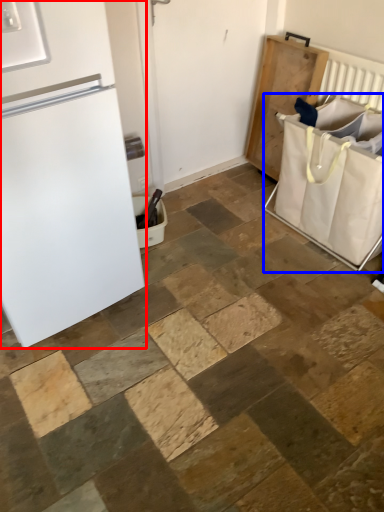
Question: Which object appears farthest to the camera in this image, refrigerator (highlighted by a red box) or laundry basket (highlighted by a blue box)?

Choices:
 (A) refrigerator
 (B) laundry basket

Answer: (B)